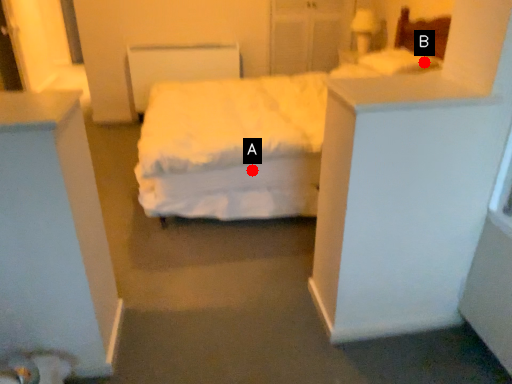
Question: Two points are circled on the image, labeled by A and B beside each circle. Which of the following is the farthest from the observer?

Choices:
 (A) A is further
 (B) B is further

Answer: (B)